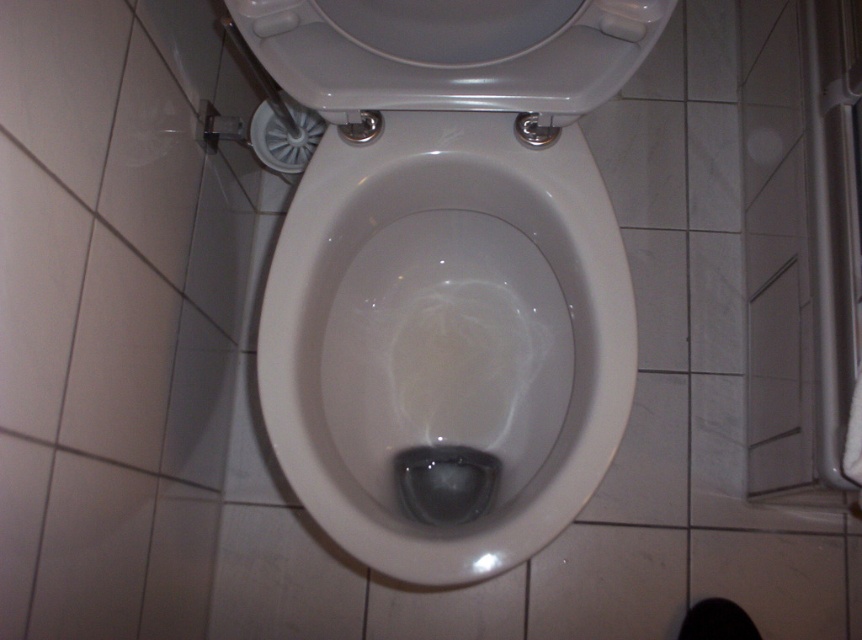
Is point (538, 4) positioned behind point (633, 541)?

That is False.

Is white glossy toilet seat at upper center above white glossy tile at lower center?

Correct, white glossy toilet seat at upper center is located above white glossy tile at lower center.

Which is in front, point (579, 54) or point (686, 593)?

Point (579, 54) is more forward.

The image size is (862, 640). I want to click on white glossy toilet seat at upper center, so click(450, 52).

Find the location of a particular element. Image resolution: width=862 pixels, height=640 pixels. white glossy toilet bowl at center is located at coordinates (442, 332).

Is white glossy toilet bowl at center above white glossy toilet seat at upper center?

No.

Is point (283, 330) more distant than point (588, 20)?

Yes, it is behind point (588, 20).

Find the location of `white glossy toilet bowl at center`. white glossy toilet bowl at center is located at coordinates (442, 332).

Can you confirm if white glossy toilet bowl at center is positioned to the left of white glossy tile at lower center?

Yes, white glossy toilet bowl at center is to the left of white glossy tile at lower center.

Does white glossy toilet bowl at center have a greater height compared to white glossy tile at lower center?

Yes.

What do you see at coordinates (442, 332) in the screenshot? This screenshot has width=862, height=640. I see `white glossy toilet bowl at center` at bounding box center [442, 332].

In order to click on white glossy toilet bowl at center in this screenshot , I will do `click(442, 332)`.